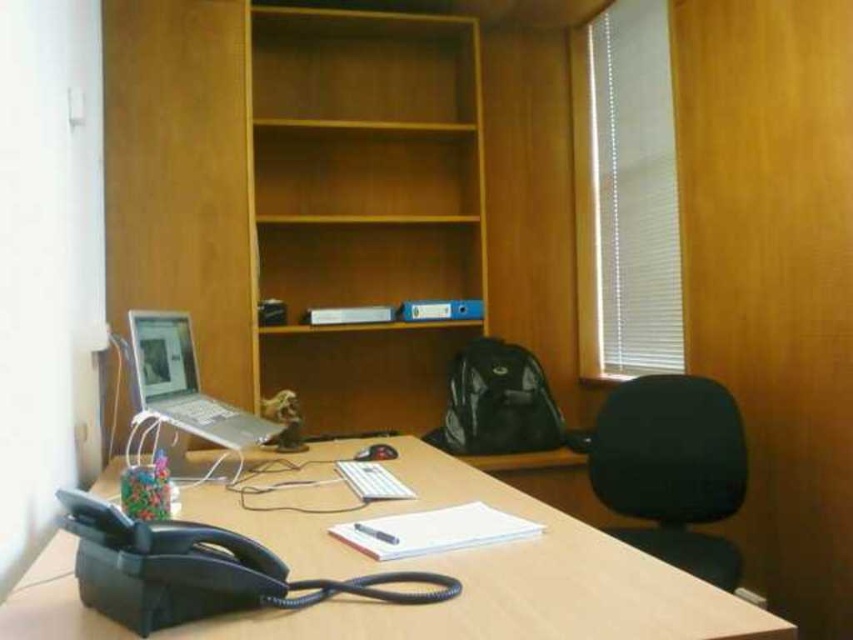
Is wooden bookshelf at center taller than silver metallic laptop at left?

Indeed, wooden bookshelf at center has a greater height compared to silver metallic laptop at left.

Who is positioned more to the right, wooden bookshelf at center or silver metallic laptop at left?

From the viewer's perspective, wooden bookshelf at center appears more on the right side.

Who is more forward, (186, 202) or (141, 378)?

Positioned in front is point (141, 378).

The width and height of the screenshot is (853, 640). In order to click on wooden bookshelf at center in this screenshot , I will do `click(294, 192)`.

Which is behind, point (712, 552) or point (234, 412)?

The point (234, 412) is more distant.

Can you confirm if black fabric swivel chair at right is wider than silver metallic laptop at left?

Yes.

Is point (724, 426) less distant than point (129, 316)?

No, (724, 426) is behind (129, 316).

I want to click on black fabric swivel chair at right, so click(x=672, y=468).

Between light brown wood computer desk at lower center and silver metallic laptop at left, which one has less height?

Standing shorter between the two is light brown wood computer desk at lower center.

Does light brown wood computer desk at lower center have a smaller size compared to silver metallic laptop at left?

Actually, light brown wood computer desk at lower center might be larger than silver metallic laptop at left.

This screenshot has width=853, height=640. I want to click on light brown wood computer desk at lower center, so click(479, 573).